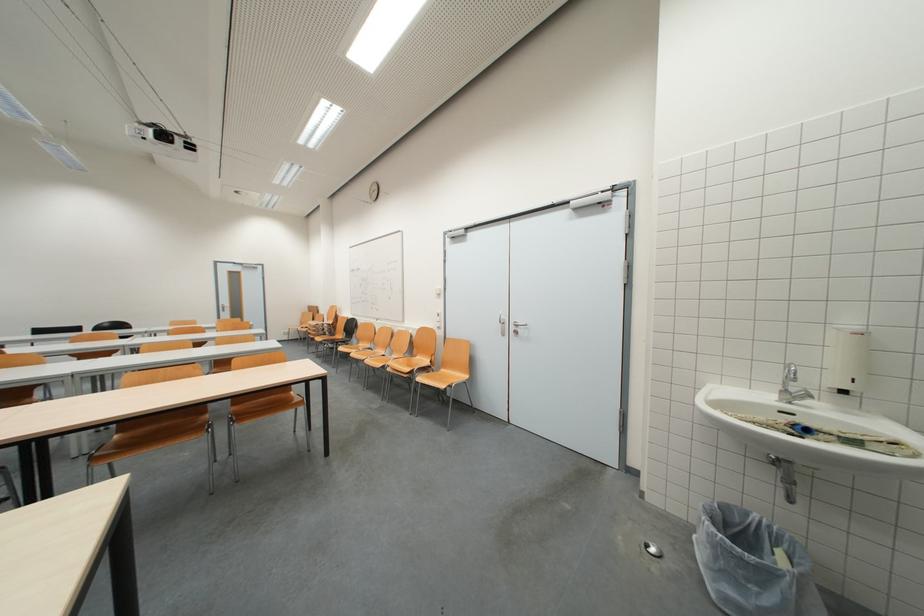
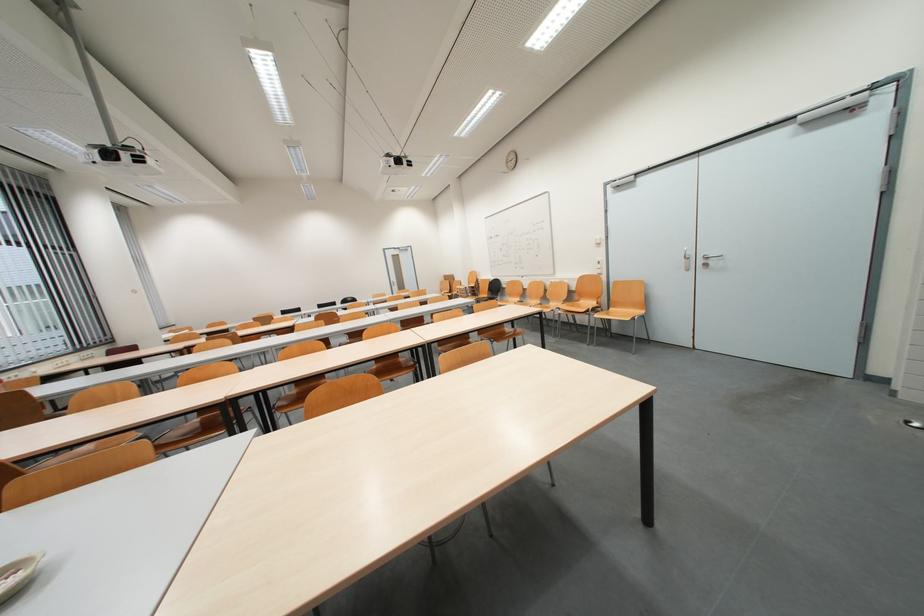
Find the pixel in the second image that matches point (293, 392) in the first image.

(507, 330)